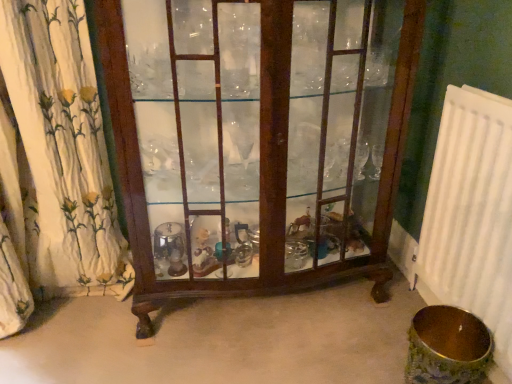
Where is `vacant space that is in between mahogany glass cabinet at center and white floral fabric at left`? vacant space that is in between mahogany glass cabinet at center and white floral fabric at left is located at coordinates (89, 341).